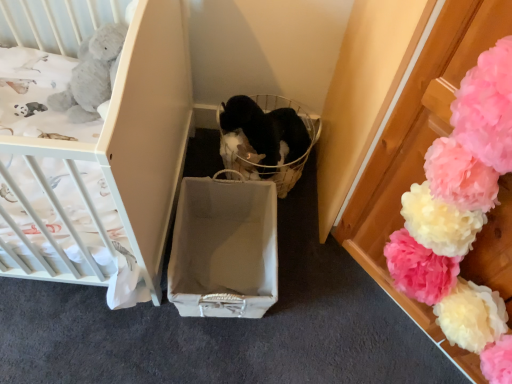
The image size is (512, 384). Identify the location of free spot below matte gray cardboard box at center (from a real-world perspective). (213, 253).